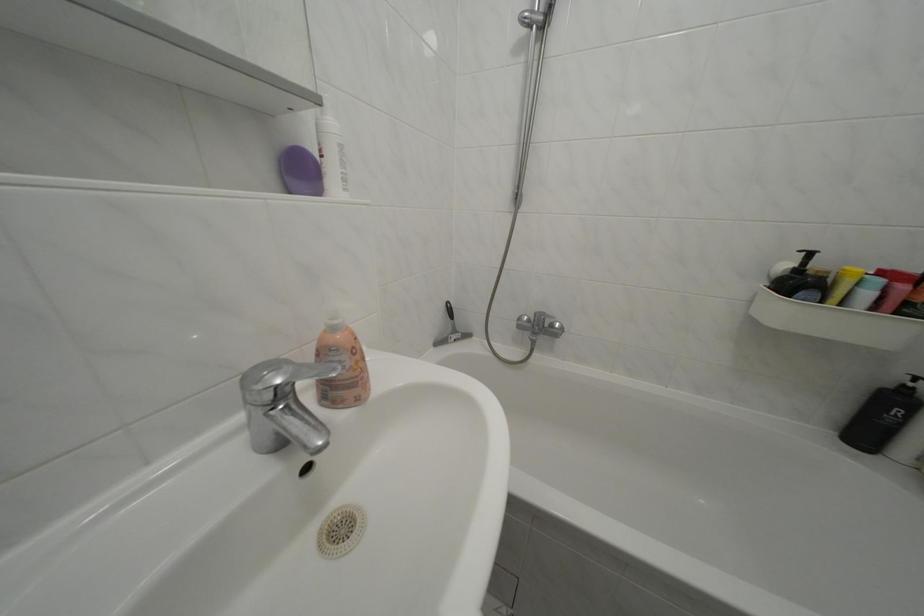
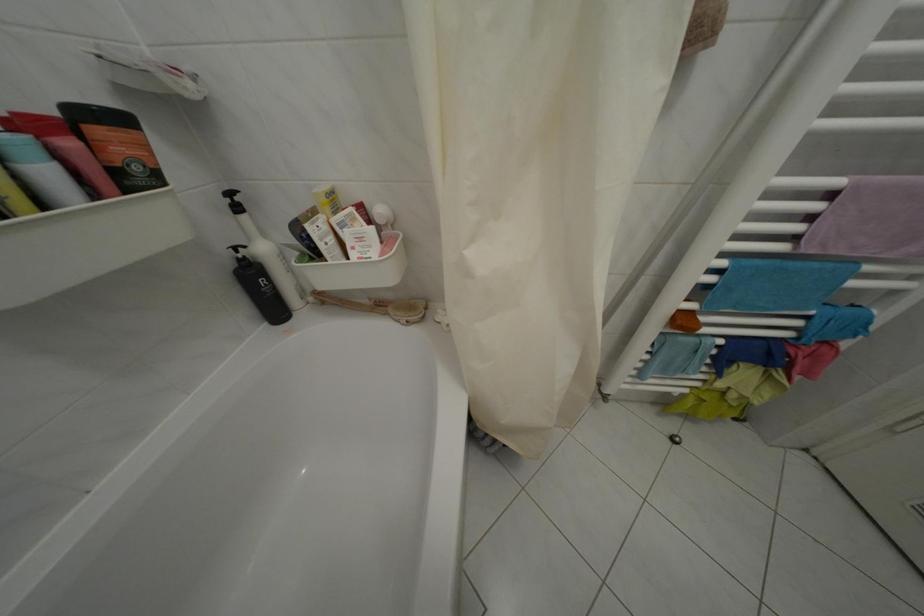
The first image is from the beginning of the video and the second image is from the end. How did the camera likely rotate when shooting the video?

The camera rotated toward right-down.